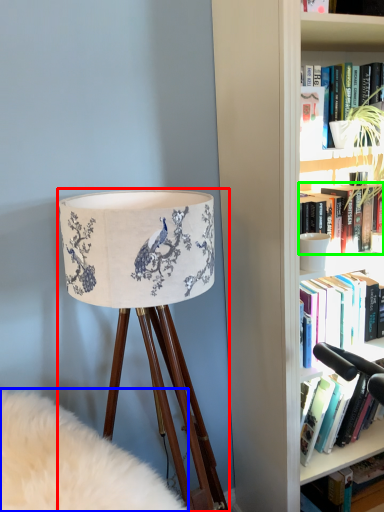
Question: Estimate the real-world distances between objects in this image. Which object is farther from lamp (highlighted by a red box), plain (highlighted by a blue box) or book (highlighted by a green box)?

Choices:
 (A) plain
 (B) book

Answer: (B)